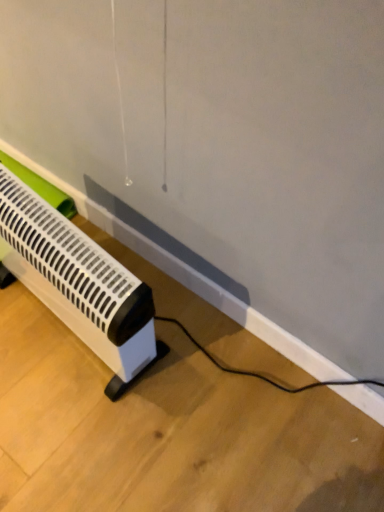
Where is `vacant space to the right of white plastic heater at lower left`? vacant space to the right of white plastic heater at lower left is located at coordinates (199, 362).